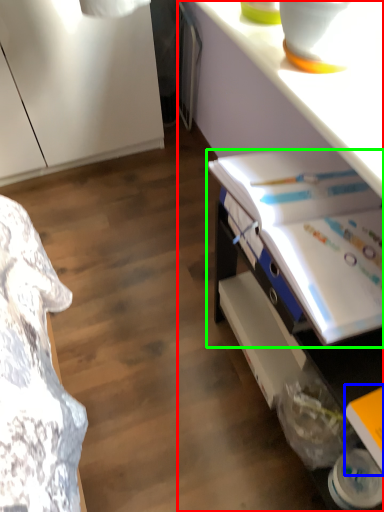
Question: Considering the real-world distances, which object is closest to desk (highlighted by a red box)? book (highlighted by a blue box) or book (highlighted by a green box).

Choices:
 (A) book
 (B) book

Answer: (B)